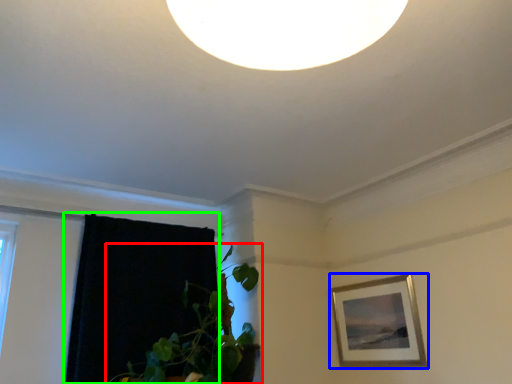
Question: Based on their relative distances, which object is farther from houseplant (highlighted by a red box)? Choose from picture frame (highlighted by a blue box) and curtain (highlighted by a green box).

Choices:
 (A) picture frame
 (B) curtain

Answer: (A)